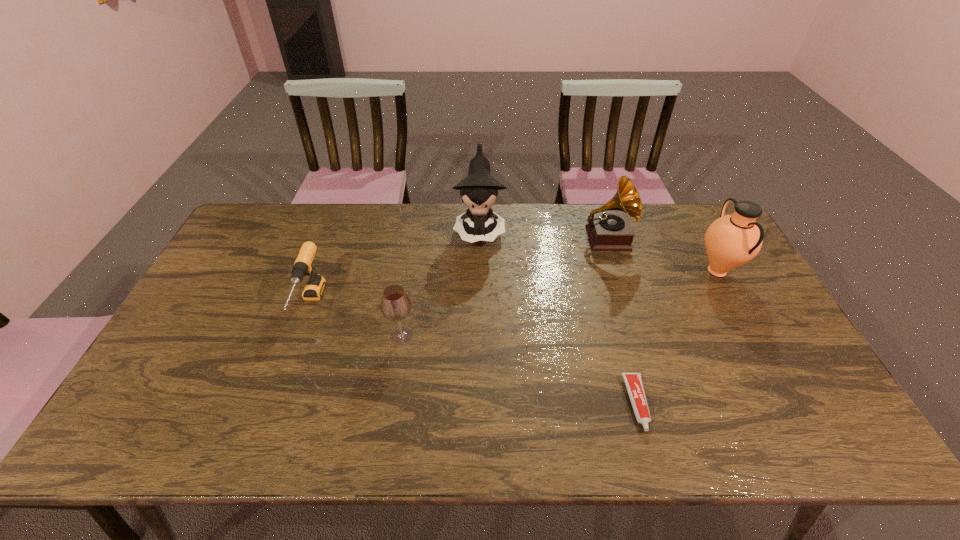
Where is `vacant area at the right edge`? This screenshot has width=960, height=540. vacant area at the right edge is located at coordinates (769, 322).

Locate an element on the screen. vacant space at the far left corner of the desktop is located at coordinates (276, 206).

The height and width of the screenshot is (540, 960). In order to click on vacant area at the far right corner in this screenshot , I will do click(707, 208).

The image size is (960, 540). I want to click on vacant point located between the doll and the second object from left to right, so click(x=441, y=282).

At what (x,y) coordinates should I click in order to perform the action: click on vacant area that lies between the wineglass and the phonograph record. Please return your answer as a coordinate pair (x, y). Looking at the image, I should click on (504, 287).

The height and width of the screenshot is (540, 960). Find the location of `blank region between the phonograph record and the wineglass`. blank region between the phonograph record and the wineglass is located at coordinates (504, 287).

The width and height of the screenshot is (960, 540). What are the coordinates of `unoccupied area between the leftmost object and the shortest object` in the screenshot? It's located at (473, 354).

The height and width of the screenshot is (540, 960). I want to click on vacant space that is in between the doll and the fifth tallest object, so click(x=395, y=267).

The height and width of the screenshot is (540, 960). What are the coordinates of `free space between the phonograph record and the wineglass` in the screenshot? It's located at pos(504,287).

Locate an element on the screen. Image resolution: width=960 pixels, height=540 pixels. free space between the leftmost object and the phonograph record is located at coordinates (459, 272).